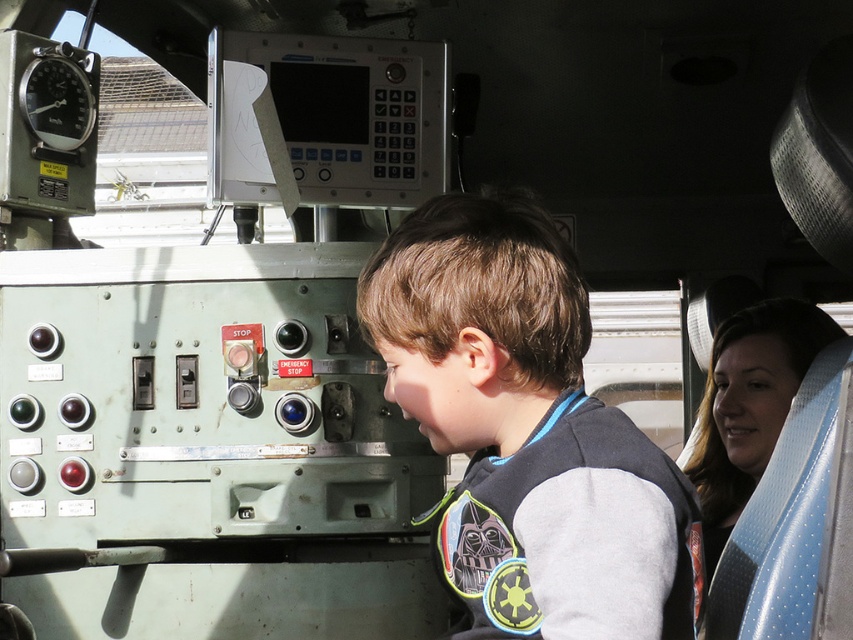
Question: Can you confirm if gray fleece sweatshirt at center is positioned below blue textured seat at right?

Choices:
 (A) yes
 (B) no

Answer: (B)

Question: Does gray fleece sweatshirt at center have a lesser width compared to blue textured seat at right?

Choices:
 (A) yes
 (B) no

Answer: (B)

Question: Which point is farther to the camera?

Choices:
 (A) (358, 296)
 (B) (746, 346)

Answer: (B)

Question: Considering the relative positions of gray fleece sweatshirt at center and blue textured seat at right in the image provided, where is gray fleece sweatshirt at center located with respect to blue textured seat at right?

Choices:
 (A) left
 (B) right

Answer: (A)